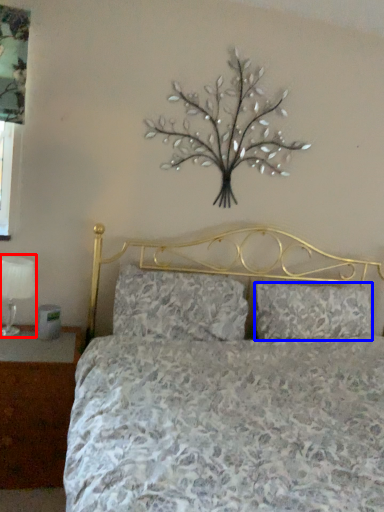
Question: Among these objects, which one is farthest to the camera, table lamp (highlighted by a red box) or pillow (highlighted by a blue box)?

Choices:
 (A) table lamp
 (B) pillow

Answer: (B)